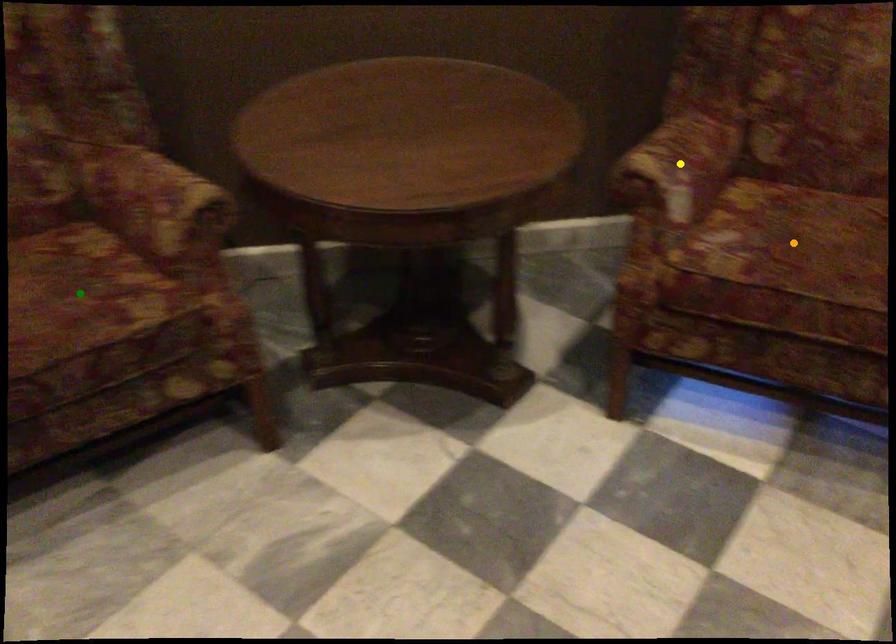
Order these from nearest to farthest:
yellow point, green point, orange point

1. orange point
2. yellow point
3. green point